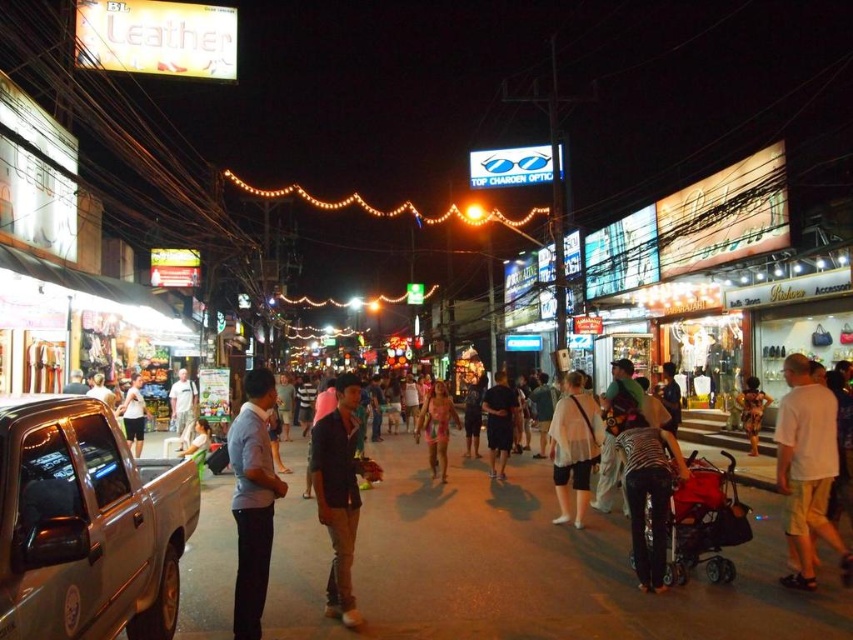
Question: Does leopard print dress at center come behind white matte tank top at center?

Choices:
 (A) no
 (B) yes

Answer: (B)

Question: In this image, where is dark matte shirt at center located relative to matte black shirt at center?

Choices:
 (A) above
 (B) below

Answer: (B)

Question: Which point is farther from the camera taking this photo?

Choices:
 (A) (799, 461)
 (B) (747, 397)
 (C) (206, 426)

Answer: (B)

Question: Is silver metallic pickup truck at lower left positioned in front of dark matte shirt at center?

Choices:
 (A) yes
 (B) no

Answer: (A)

Question: Which object appears closest to the camera in this image?

Choices:
 (A) leopard print dress at center
 (B) silver metallic pickup truck at lower left
 (C) white matte shirt at center

Answer: (B)

Question: Which object is positioned farthest from the zebra print shirt at lower right?

Choices:
 (A) dark matte shirt at center
 (B) white matte shirt at center

Answer: (A)